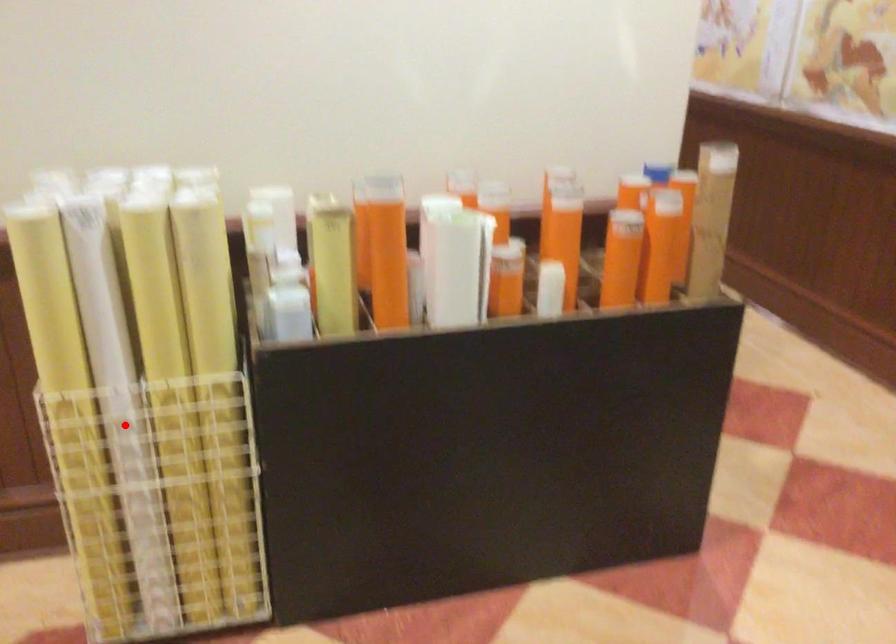
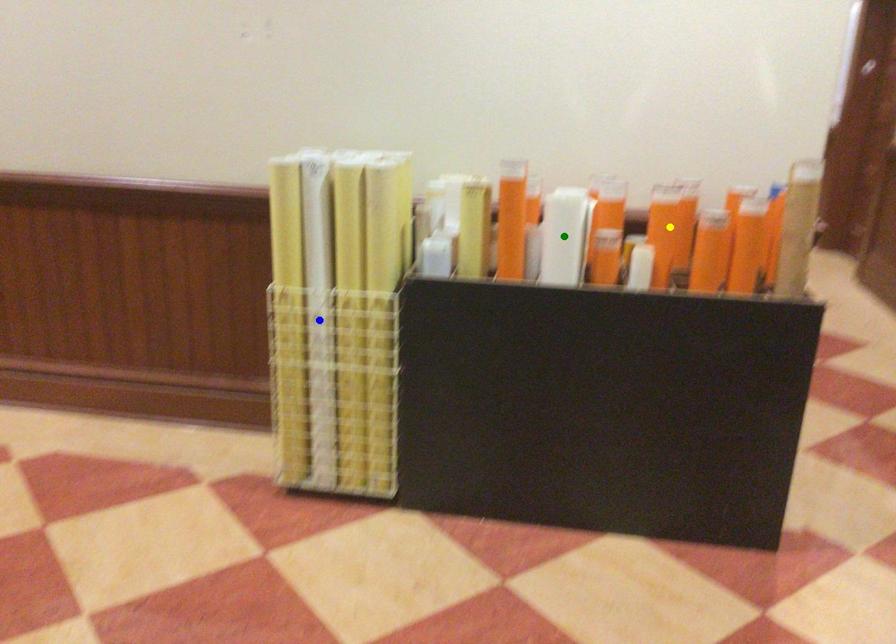
Question: I am providing you with two images of the same scene from different viewpoints. A red point is marked on the first image. You are given multiple points on the second image. In image 2, which mark is for the same physical point as the one in image 1?

Choices:
 (A) yellow point
 (B) green point
 (C) blue point

Answer: (C)